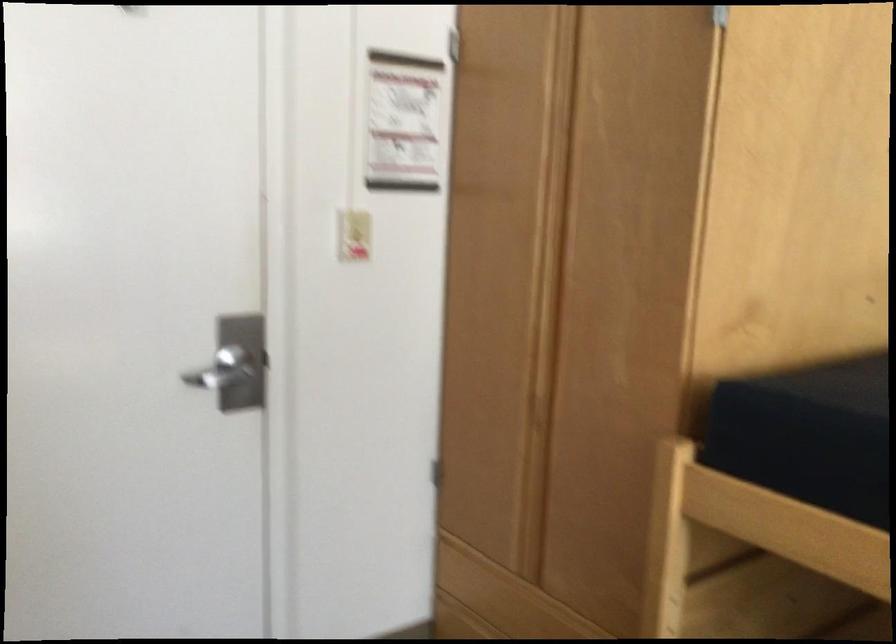
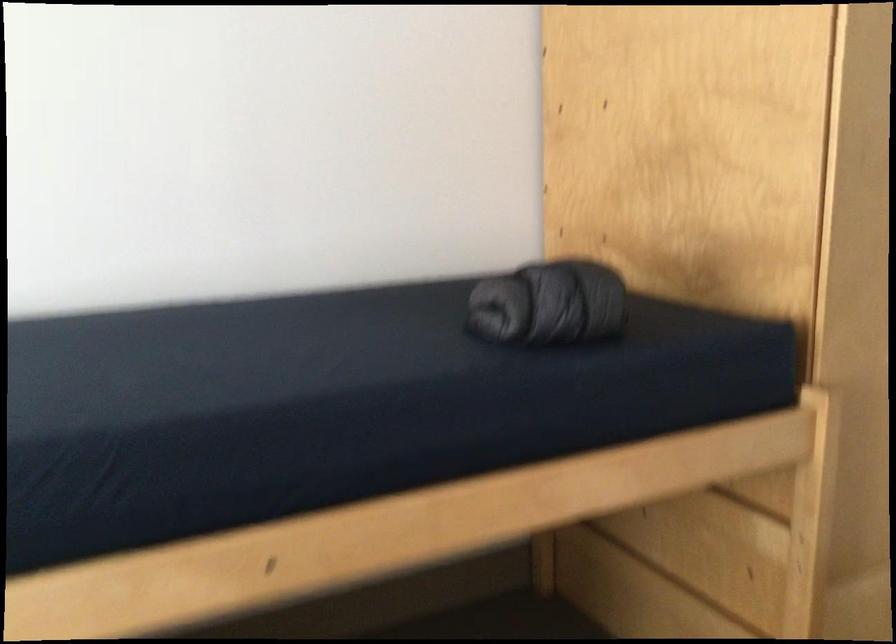
Question: The camera is either moving clockwise (left) or counter-clockwise (right) around the object. The first image is from the beginning of the video and the second image is from the end. Is the camera moving left or right when shooting the video?

Choices:
 (A) Left
 (B) Right

Answer: (B)